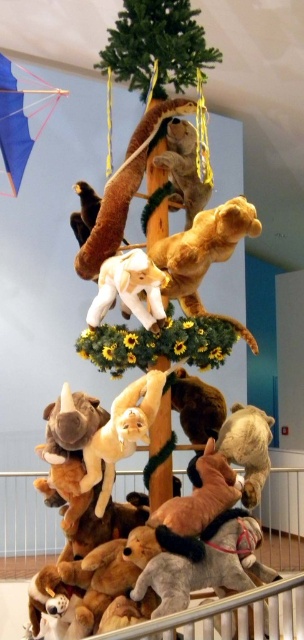
Question: Does soft brown plush monkey at center have a smaller size compared to white plush elephant at center?

Choices:
 (A) yes
 (B) no

Answer: (B)

Question: Can you confirm if fuzzy brown bear at upper center is smaller than brown plush monkey at center?

Choices:
 (A) no
 (B) yes

Answer: (A)

Question: Which object is closer to the camera taking this photo?

Choices:
 (A) green matte tree at upper center
 (B) brown plush monkey at center
 (C) fuzzy beige bear at lower right
 (D) white plush elephant at center

Answer: (D)

Question: Which point is farther to the camera?

Choices:
 (A) brown plush monkey at center
 (B) soft brown plush monkey at center
 (C) fuzzy brown bear at upper center

Answer: (C)

Question: Does fuzzy beige bear at lower right have a larger size compared to fuzzy brown bear at upper center?

Choices:
 (A) yes
 (B) no

Answer: (B)

Question: Estimate the real-world distances between objects in this image. Which object is farther from the fuzzy beige bear at lower right?

Choices:
 (A) brown plush monkey at center
 (B) fuzzy brown bear at upper center
 (C) blue fabric kite at upper left

Answer: (C)